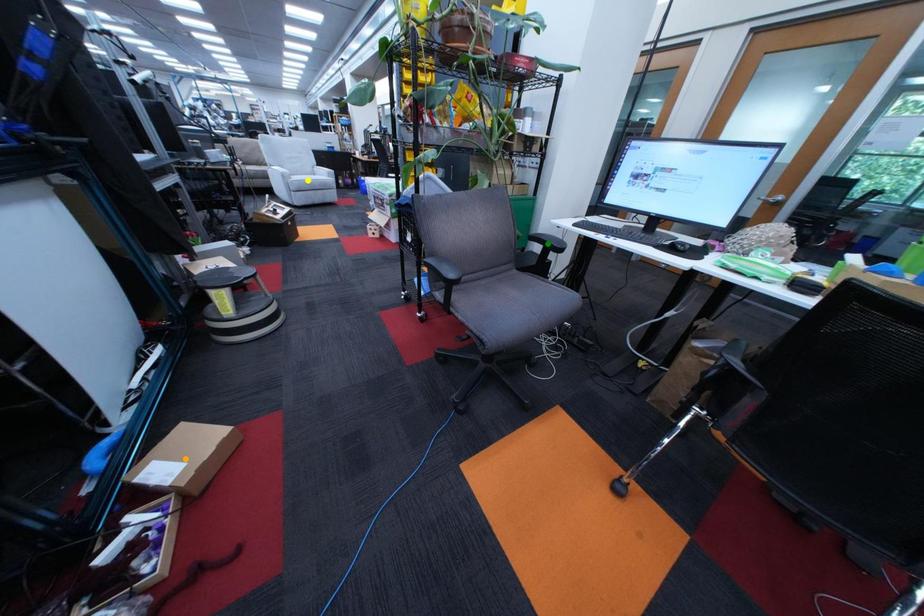
Order these from farthest to nearest:
1. yellow point
2. green point
3. orange point

yellow point, green point, orange point